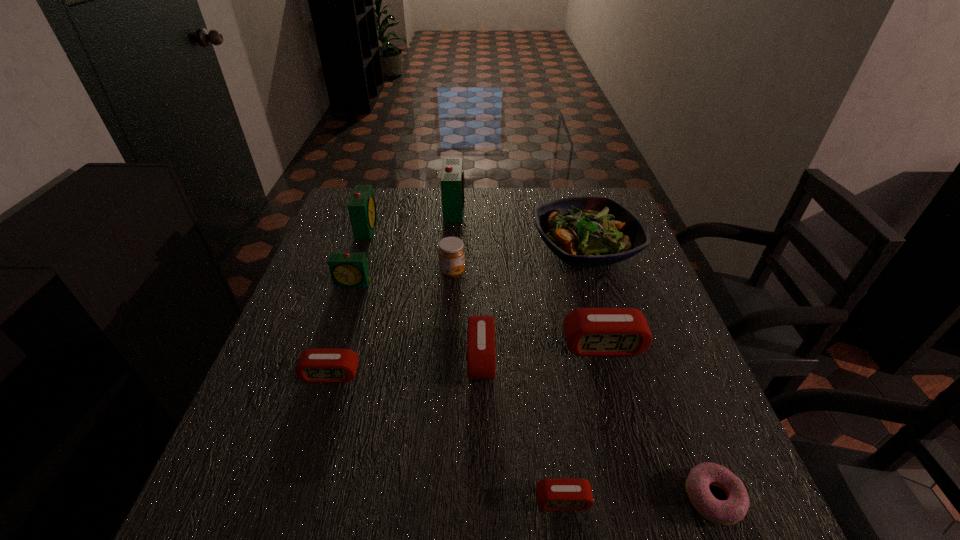
At what (x,y) coordinates should I click in order to perform the action: click on empty space that is in between the nearest green alarm clock and the pink doughnut. Please return your answer as a coordinate pair (x, y). The width and height of the screenshot is (960, 540). Looking at the image, I should click on (534, 390).

Image resolution: width=960 pixels, height=540 pixels. I want to click on object that is the fourth closest to the rightmost alarm clock, so click(x=552, y=494).

This screenshot has width=960, height=540. In order to click on the ninth closest object to the tallest object in this screenshot , I will do `click(727, 512)`.

At what (x,y) coordinates should I click in order to perform the action: click on alarm clock that can be found as the third closest to the doughnut. Please return your answer as a coordinate pair (x, y). The image size is (960, 540). Looking at the image, I should click on (481, 363).

Choose which alarm clock is the third nearest neighbor to the fourth alarm clock from left to right. Please provide its 2D coordinates. Your answer should be formatted as a tuple, i.e. [(x, y)], where the tuple contains the x and y coordinates of a point satisfying the conditions above.

[(481, 363)]

Locate which green alarm clock is the closest to the biggest pink alarm clock. Please provide its 2D coordinates. Your answer should be formatted as a tuple, i.e. [(x, y)], where the tuple contains the x and y coordinates of a point satisfying the conditions above.

[(348, 270)]

Identify the location of green alarm clock that is the closest to the nearest pink alarm clock. This screenshot has width=960, height=540. (348, 270).

Select which pink alarm clock is the fourth closest to the fifth nearest alarm clock. Please provide its 2D coordinates. Your answer should be formatted as a tuple, i.e. [(x, y)], where the tuple contains the x and y coordinates of a point satisfying the conditions above.

[(552, 494)]

I want to click on the third closest pink alarm clock to the sixth alarm clock from left to right, so click(315, 365).

I want to click on vacant position in the image that satisfies the following two spatial constraints: 1. on the front-facing side of the tallest object; 2. on the front-facing side of the leftmost pink alarm clock, so click(442, 375).